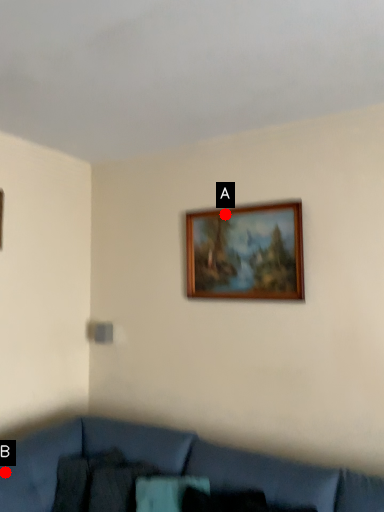
Question: Two points are circled on the image, labeled by A and B beside each circle. Which of the following is the closest to the observer?

Choices:
 (A) A is closer
 (B) B is closer

Answer: (B)